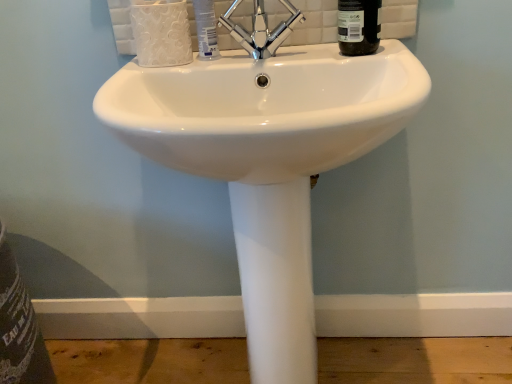
Question: Is chrome metallic faucet at center closer to camera compared to white plastic tube at center?

Choices:
 (A) no
 (B) yes

Answer: (B)

Question: Is chrome metallic faucet at center behind white plastic tube at center?

Choices:
 (A) no
 (B) yes

Answer: (A)

Question: Considering the relative positions of chrome metallic faucet at center and white plastic tube at center in the image provided, is chrome metallic faucet at center to the right of white plastic tube at center from the viewer's perspective?

Choices:
 (A) no
 (B) yes

Answer: (B)

Question: Is chrome metallic faucet at center positioned beyond the bounds of white plastic tube at center?

Choices:
 (A) yes
 (B) no

Answer: (A)

Question: From a real-world perspective, is chrome metallic faucet at center over white plastic tube at center?

Choices:
 (A) yes
 (B) no

Answer: (A)

Question: Does chrome metallic faucet at center have a larger size compared to white plastic tube at center?

Choices:
 (A) yes
 (B) no

Answer: (A)

Question: Does white ceramic sink at center have a larger size compared to white plastic tube at center?

Choices:
 (A) yes
 (B) no

Answer: (A)

Question: From the image's perspective, is white ceramic sink at center on top of white plastic tube at center?

Choices:
 (A) no
 (B) yes

Answer: (A)

Question: From a real-world perspective, is white ceramic sink at center below white plastic tube at center?

Choices:
 (A) no
 (B) yes

Answer: (B)

Question: Does white ceramic sink at center turn towards white plastic tube at center?

Choices:
 (A) yes
 (B) no

Answer: (B)

Question: Can white plastic tube at center be found inside white ceramic sink at center?

Choices:
 (A) no
 (B) yes

Answer: (A)

Question: Can you confirm if white ceramic sink at center is smaller than white plastic tube at center?

Choices:
 (A) no
 (B) yes

Answer: (A)

Question: Considering the relative positions of white ceramic sink at center and black glass bottle at upper right in the image provided, is white ceramic sink at center in front of black glass bottle at upper right?

Choices:
 (A) yes
 (B) no

Answer: (A)